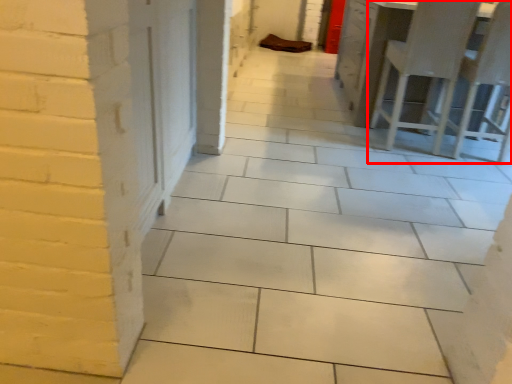
Question: From the image's perspective, what is the correct spatial relationship of furniture (annotated by the red box) in relation to chair?

Choices:
 (A) below
 (B) above

Answer: (B)